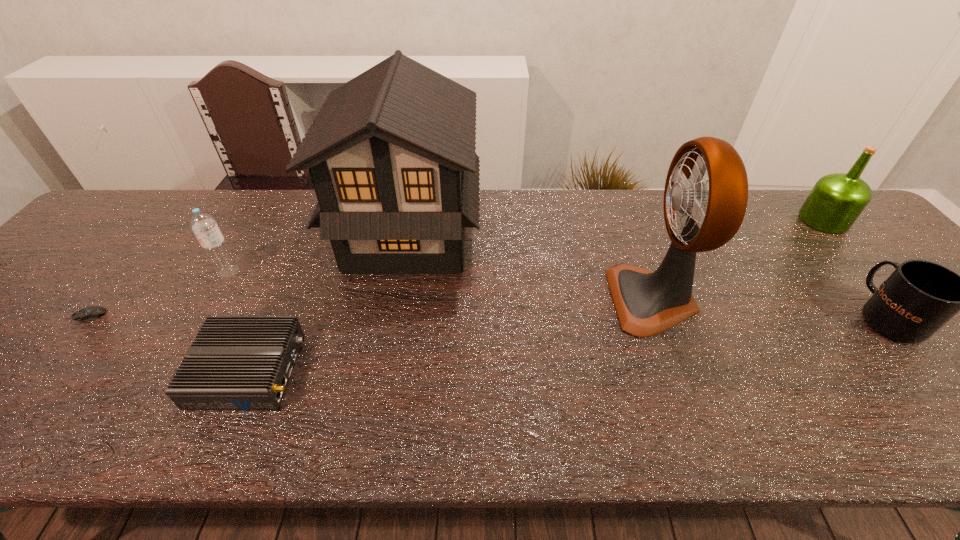
Find the location of a particular element. This screenshot has height=540, width=960. free spot between the second object from left to right and the shortest object is located at coordinates (158, 294).

Locate an element on the screen. The width and height of the screenshot is (960, 540). object that can be found as the fourth closest to the sixth tallest object is located at coordinates (647, 303).

At what (x,y) coordinates should I click in order to perform the action: click on object that can be found as the sixth closest to the router. Please return your answer as a coordinate pair (x, y). The image size is (960, 540). Looking at the image, I should click on [x=835, y=202].

This screenshot has height=540, width=960. I want to click on blank space that satisfies the following two spatial constraints: 1. with the handle on the side of the olive oil; 2. on the left side of the mug, so click(805, 220).

You are a GUI agent. You are given a task and a screenshot of the screen. Output one action in this format:
    pyautogui.click(x=<x>, y=<y>)
    Task: Click on the vacant space that satisfies the following two spatial constraints: 1. with the handle on the side of the mug; 2. on the front-facing side of the third object from right to left
    
    Given the screenshot: What is the action you would take?
    pyautogui.click(x=874, y=300)

This screenshot has height=540, width=960. I want to click on vacant space that satisfies the following two spatial constraints: 1. with the handle on the side of the mug; 2. on the front-facing side of the dollhouse, so click(x=818, y=234).